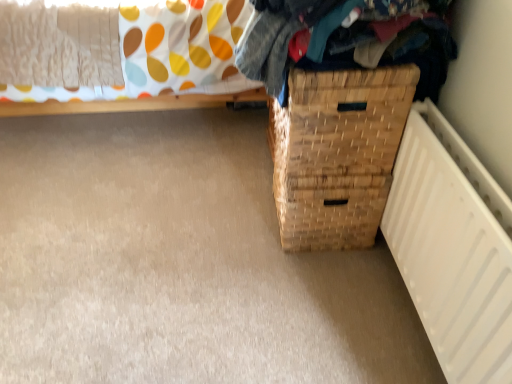
Find the location of a particular element. free spot below white matte radiator at lower right (from a real-world perspective) is located at coordinates (404, 309).